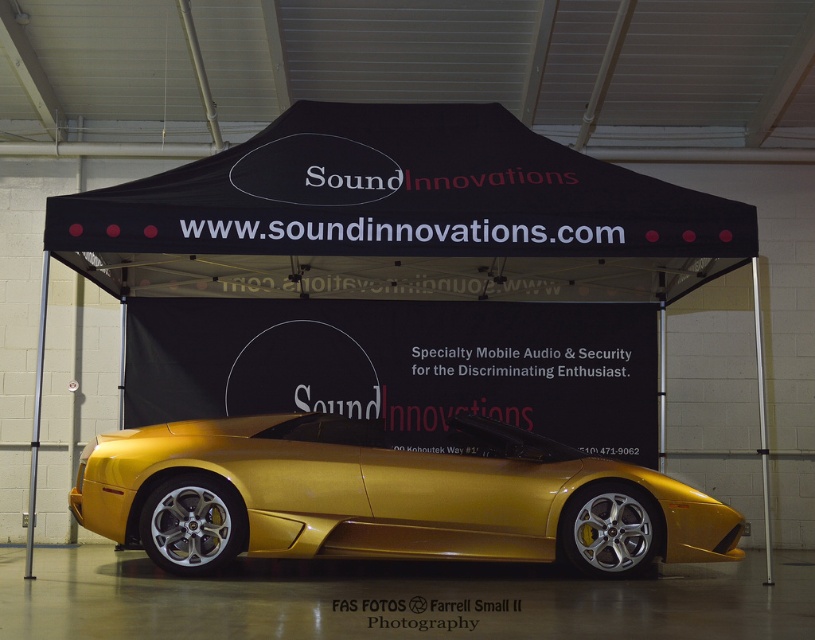
You are a photographer standing 2 meters away from the black fabric tent at center. You want to take a photo of the gold metallic sports car at center without moving closer. Can you capture the entire car in your shot if your camera has a maximum zoom range of 5 meters?

The distance between the black fabric tent at center and the gold metallic sports car at center is 3.15 meters. Since you are already 2 meters away from the tent, the total distance to the car is 5.15 meters. Your camera can zoom up to 5 meters, so you cannot capture the entire car without moving closer.

You are a photographer planning to take a photo of the gold metallic sports car at center. You notice the black fabric tent at center is blocking part of the car. Based on their heights, can you determine if the tent is taller than the car?

The black fabric tent at center has a lesser height compared to gold metallic sports car at center, so the tent is shorter than the car. Therefore, the tent is not taller than the car and may not block the top part of the car in your photo.